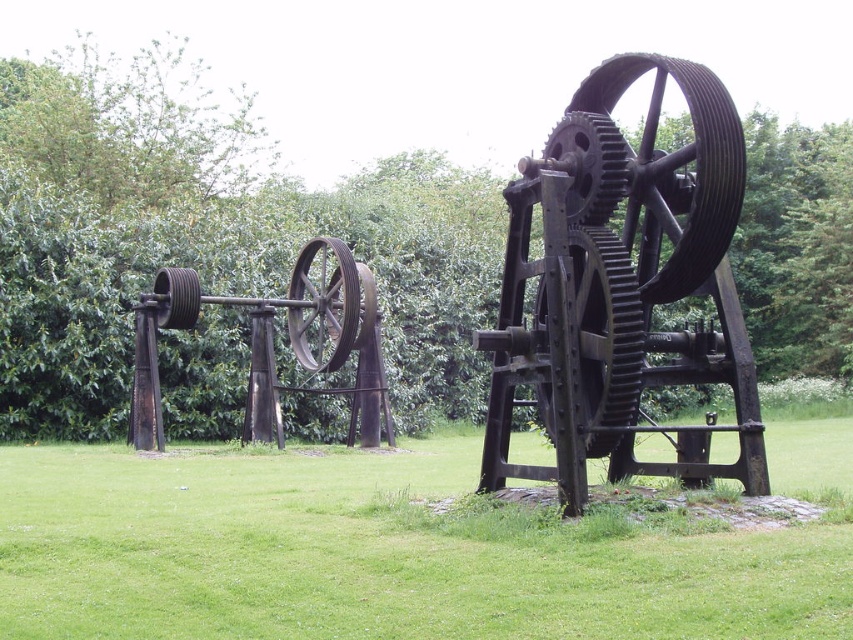
I want to click on green leafy tree at upper center, so [207, 237].

Does point (424, 230) come farther from viewer compared to point (347, 294)?

Yes, point (424, 230) is farther from viewer.

Between point (84, 216) and point (341, 330), which one is positioned behind?

The point (84, 216) is behind.

Find the location of a particular element. This screenshot has height=640, width=853. green leafy tree at upper center is located at coordinates (207, 237).

Is green leafy tree at upper center bigger than rustic metal wheel at center?

Yes.

Describe the element at coordinates (207, 237) in the screenshot. I see `green leafy tree at upper center` at that location.

This screenshot has width=853, height=640. In order to click on green leafy tree at upper center in this screenshot , I will do `click(207, 237)`.

Between green leafy tree at upper center and green grass at center, which one is positioned higher?

green leafy tree at upper center

From the picture: Can you confirm if green leafy tree at upper center is wider than green grass at center?

Correct, the width of green leafy tree at upper center exceeds that of green grass at center.

Does point (126, 332) come in front of point (129, 500)?

No, (126, 332) is behind (129, 500).

At what (x,y) coordinates should I click in order to perform the action: click on green leafy tree at upper center. Please return your answer as a coordinate pair (x, y). This screenshot has height=640, width=853. Looking at the image, I should click on (207, 237).